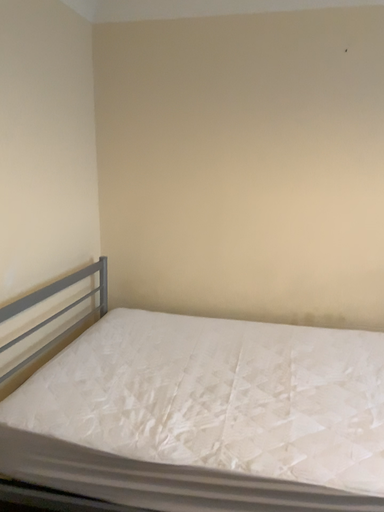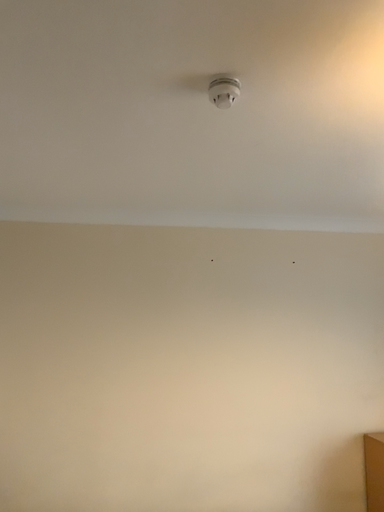
Question: How did the camera likely rotate when shooting the video?

Choices:
 (A) rotated upward
 (B) rotated downward

Answer: (A)